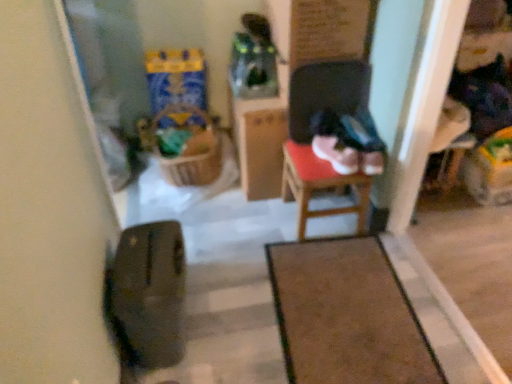
In order to click on vacant area that lies to the right of transparent glass door at left in this screenshot , I will do `click(196, 218)`.